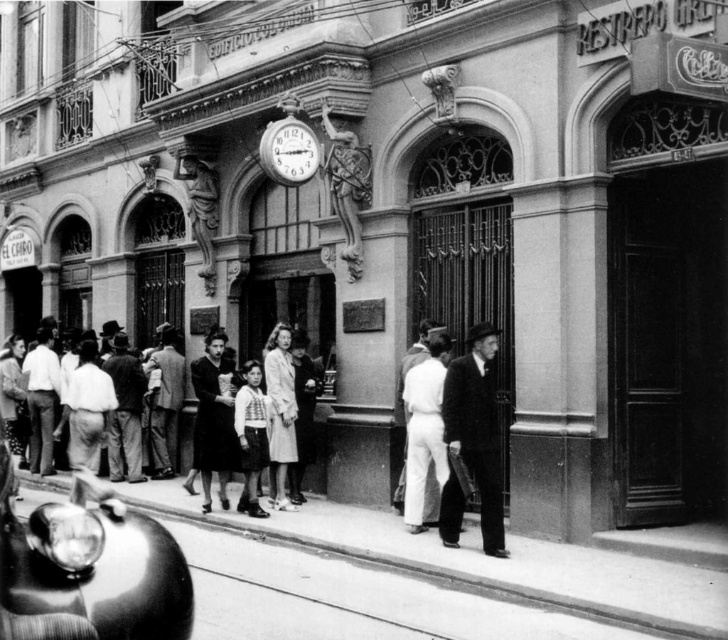
Does white cotton pants at center have a lesser height compared to metallic clock at center?

In fact, white cotton pants at center may be taller than metallic clock at center.

Between white cotton pants at center and metallic clock at center, which one has more height?

white cotton pants at center is taller.

The width and height of the screenshot is (728, 640). Identify the location of white cotton pants at center. (424, 428).

Where is `white cotton pants at center`? Image resolution: width=728 pixels, height=640 pixels. white cotton pants at center is located at coordinates (424, 428).

Can you confirm if dark suit at right is bigger than dark fabric dress at center?

No.

Does dark suit at right appear on the left side of dark fabric dress at center?

No, dark suit at right is not to the left of dark fabric dress at center.

What do you see at coordinates (478, 428) in the screenshot? Image resolution: width=728 pixels, height=640 pixels. I see `dark suit at right` at bounding box center [478, 428].

Locate an element on the screen. This screenshot has width=728, height=640. dark suit at right is located at coordinates (478, 428).

Describe the element at coordinates (213, 417) in the screenshot. This screenshot has height=640, width=728. I see `matte black dress at center` at that location.

Find the location of a particular element. This screenshot has width=728, height=640. matte black dress at center is located at coordinates (213, 417).

The width and height of the screenshot is (728, 640). Find the location of `matte black dress at center`. matte black dress at center is located at coordinates (213, 417).